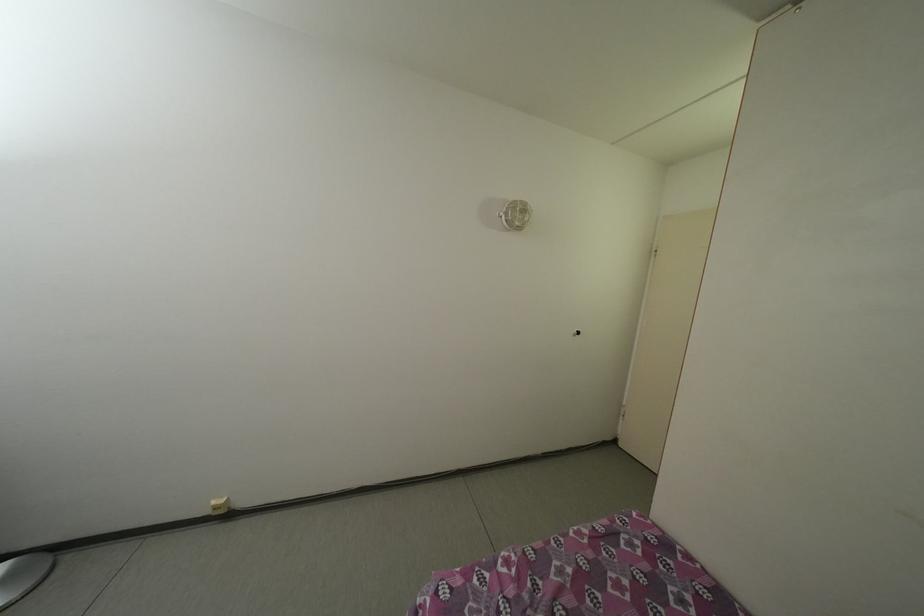
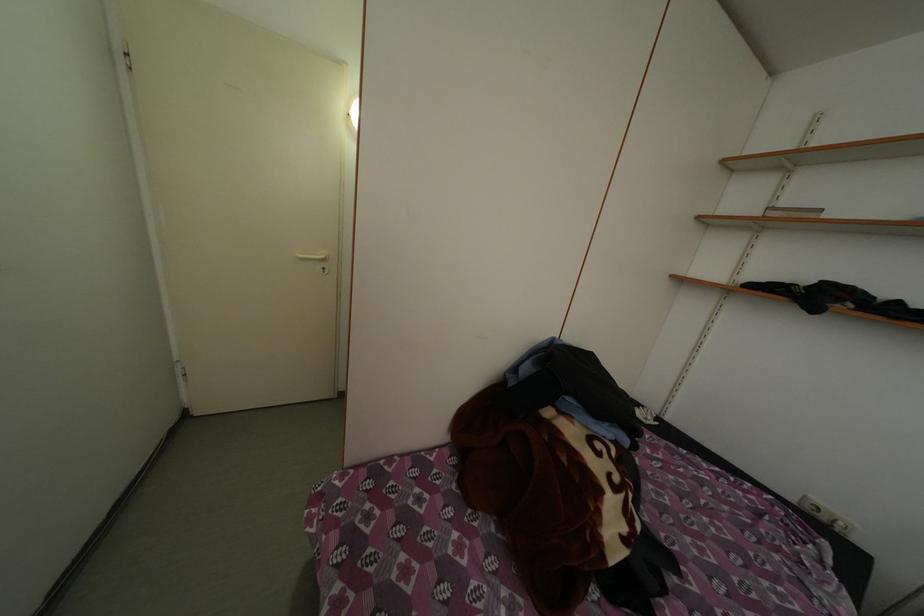
How did the camera likely rotate?

The camera rotated toward right-down.